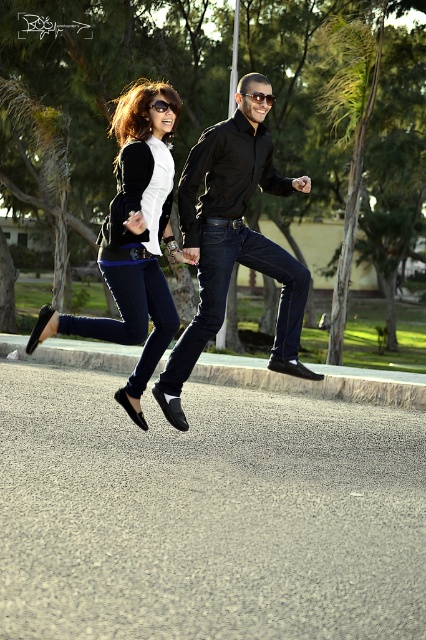
You are standing at the origin point of the image coordinate system. You want to move towards the matte black shoes at lower left. What direction should you move in?

The matte black shoes at lower left are located at coordinate point 0.380 on the x axis and 0.312 on the y axis. Since the coordinate system places the origin at the bottom left corner, you should move towards the right and upwards to reach the matte black shoes at lower left.

You are a photographer standing 2 meters away from the two people in the scene. You want to take a closeup photo of the black plastic sunglasses at upper center without including the black plastic goggles at upper center in the frame. Is this possible given their distance apart?

The black plastic sunglasses at upper center is 1.05 meters away from the black plastic goggles at upper center. Since you are 2 meters away from both objects, the distance between them is small enough that adjusting your camera angle slightly could allow you to frame the sunglasses without the goggles appearing in the shot.

You are a photographer trying to capture a closeup of the matte black shoes at lower left and the black plastic sunglasses at upper center. Which object is taller in the image?

The matte black shoes at lower left is taller than the black plastic sunglasses at upper center.